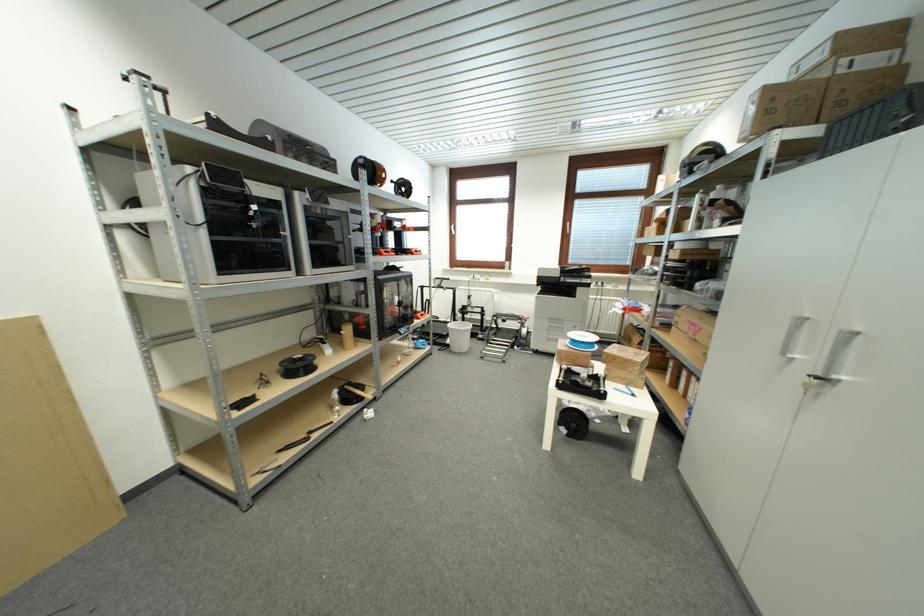
Find the location of a particular element. white waste basket is located at coordinates (458, 336).